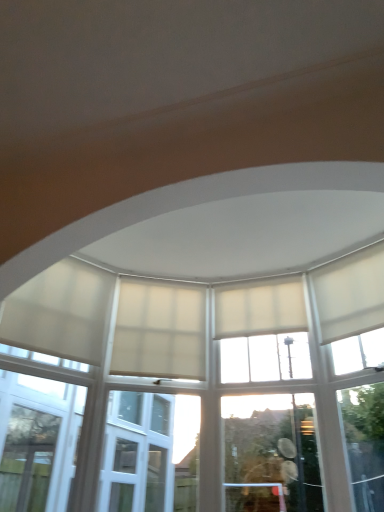
Question: Is white matte curtain at center, which is the second curtain from right to left, inside the boundaries of white matte curtain at left, the first curtain viewed from the left, or outside?

Choices:
 (A) outside
 (B) inside

Answer: (A)

Question: Looking at the image, does white matte curtain at center, which is the second curtain from right to left, seem bigger or smaller compared to white matte curtain at left, the fourth curtain positioned from the right?

Choices:
 (A) small
 (B) big

Answer: (A)

Question: Considering the real-world distances, which object is farthest from the white matte curtain at left, the first curtain viewed from the left?

Choices:
 (A) white matte curtain at center, which is the second curtain from right to left
 (B) beige fabric curtain at center, the 3th curtain when ordered from right to left
 (C) white matte curtain at upper right, which appears as the 4th curtain when viewed from the left

Answer: (C)

Question: Which object is the farthest from the white matte curtain at left, the fourth curtain positioned from the right?

Choices:
 (A) beige fabric curtain at center, the 3th curtain when ordered from right to left
 (B) white matte curtain at upper right, placed as the 1th curtain when sorted from right to left
 (C) white matte curtain at center, which is the second curtain from right to left

Answer: (B)